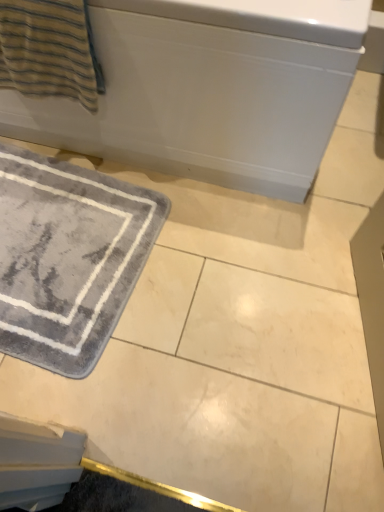
Question: Considering the positions of gray plush bath mat at lower left and striped cotton towel at upper left in the image, is gray plush bath mat at lower left taller or shorter than striped cotton towel at upper left?

Choices:
 (A) tall
 (B) short

Answer: (B)

Question: Choose the correct answer: Is gray plush bath mat at lower left inside striped cotton towel at upper left or outside it?

Choices:
 (A) outside
 (B) inside

Answer: (A)

Question: Estimate the real-world distances between objects in this image. Which object is closer to the gray plush bath mat at lower left?

Choices:
 (A) white glossy bathtub at upper center
 (B) striped cotton towel at upper left

Answer: (A)

Question: Which is farther from the gray plush bath mat at lower left?

Choices:
 (A) white glossy bathtub at upper center
 (B) striped cotton towel at upper left

Answer: (B)